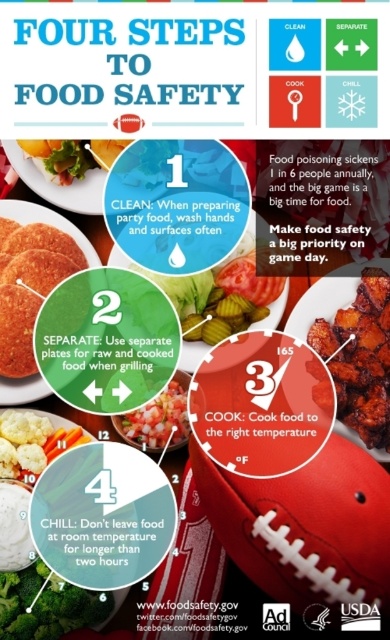
Question: Observing the image, what is the correct spatial positioning of charred crispy chicken at center in reference to matte plastic plate at upper left?

Choices:
 (A) below
 (B) above

Answer: (A)

Question: Is charred crispy chicken at center smaller than green leafy broccoli at lower left?

Choices:
 (A) no
 (B) yes

Answer: (A)

Question: Considering the real-world distances, which object is farthest from the matte brown football at center?

Choices:
 (A) charred crispy chicken at center
 (B) matte brown plate at center

Answer: (B)

Question: Estimate the real-world distances between objects in this image. Which object is farther from the charred crispy chicken at center?

Choices:
 (A) green leafy broccoli at lower left
 (B) chopped tomato salad at center
 (C) matte brown plate at center

Answer: (A)

Question: Considering the real-world distances, which object is closest to the chopped tomato salad at center?

Choices:
 (A) charred crispy chicken at center
 (B) matte plastic plate at upper left

Answer: (A)

Question: Can you confirm if matte brown plate at center is positioned to the left of chopped tomato salad at center?

Choices:
 (A) no
 (B) yes

Answer: (B)